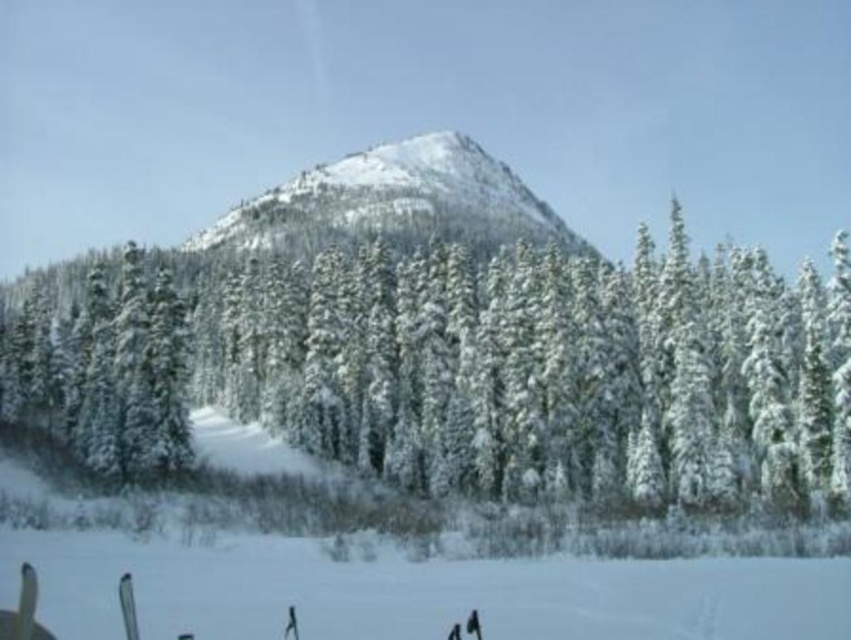
You are planning a ski trip and need to choose between the white snow ski slope at lower center and the snowy rocky peak at center. Based on their widths, which one would you recommend for a wider skiing experience?

The snowy rocky peak at center is wider than the white snow ski slope at lower center, so it would provide a wider skiing experience.

You are planning to build a small cabin for winter sports enthusiasts. The cabin needs to be placed on the white snow ski slope at lower center or the snowy rocky peak at center. Which location would allow the cabin to have a better view of the surrounding forest and mountain? Please explain your reasoning based on their heights.

The snowy rocky peak at center is taller than the white snow ski slope at lower center. Therefore, building the cabin on the snowy rocky peak at center would provide a better view of the surrounding forest and mountain due to its higher elevation.